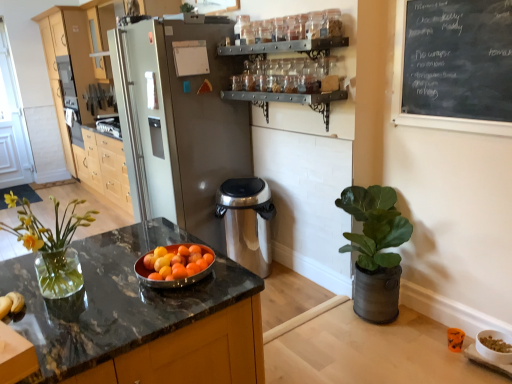
Image resolution: width=512 pixels, height=384 pixels. What are the coordinates of `blank area beneath white glossy bowl at lower right (from a real-world perspective)` in the screenshot? It's located at (499, 353).